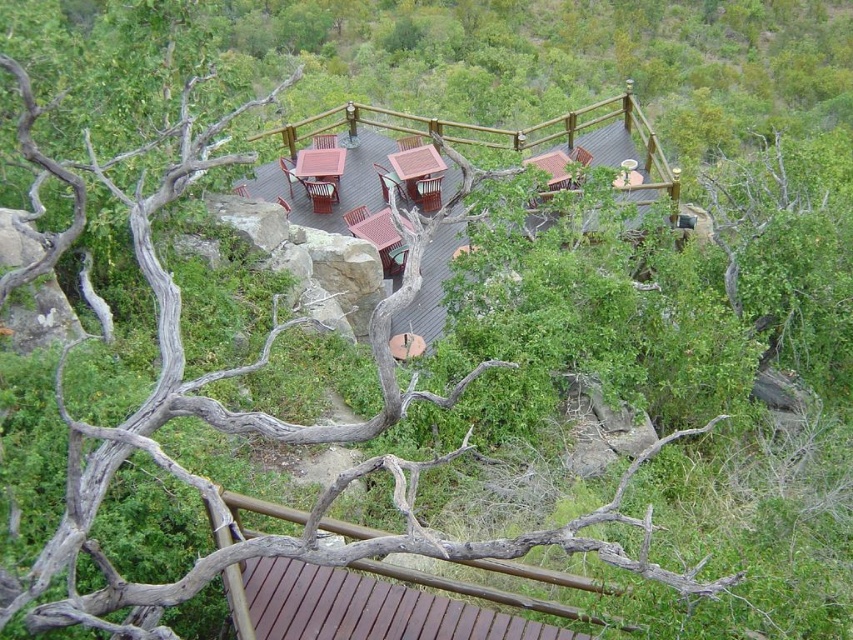
You are standing on the wooden deck at center and want to place a potted plant on the brown wooden table at center. Which direction should you move to reach the table?

Since the wooden deck at center is closer to the viewer than the brown wooden table at center, you should move forward to reach the brown wooden table at center from the wooden deck at center.

You are a guest staying at the safari lodge and want to reach the brown wooden hut at upper right from your current position on the brown wood deck at lower center. Which direction should you move to get there?

The brown wood deck at lower center is located below the brown wooden hut at upper right, so you should move upward or towards the upper right direction to reach the brown wooden hut at upper right.

You are standing at the point marked by the coordinates point (465, 147) on the wooden deck at center. You want to walk towards the large rocks bordering the deck. Which direction should you head?

The wooden deck at center is represented by point (465, 147), so you should head towards the direction where the large rocks are located, which is the border of the deck.